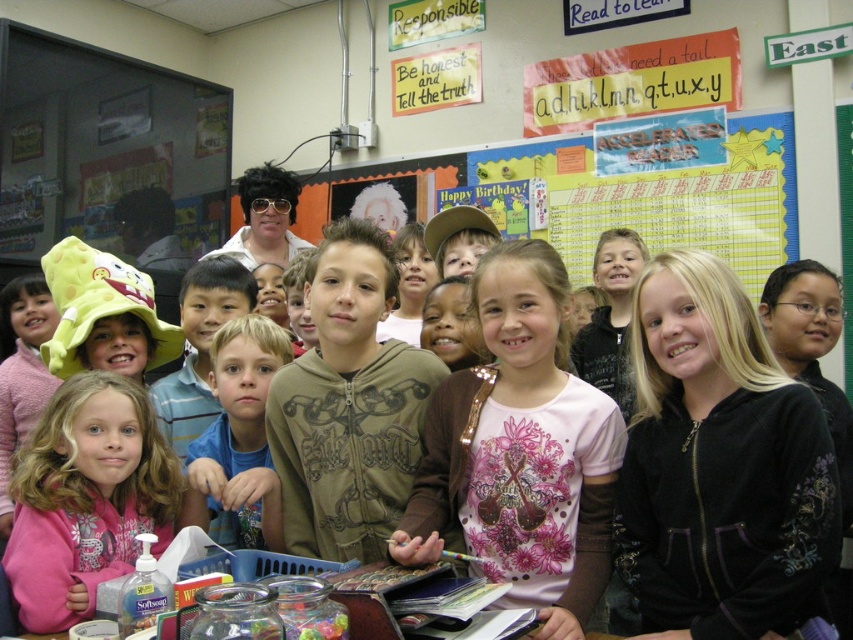
Is point (666, 528) more distant than point (564, 602)?

No, it is in front of (564, 602).

Is black velvety hoodie at center below pink satin shirt at center?

Correct, black velvety hoodie at center is located below pink satin shirt at center.

Which is in front, point (693, 266) or point (489, 499)?

Positioned in front is point (693, 266).

You are a GUI agent. You are given a task and a screenshot of the screen. Output one action in this format:
    pyautogui.click(x=<x>, y=<y>)
    Task: Click on the black velvety hoodie at center
    The width and height of the screenshot is (853, 640).
    Given the screenshot: What is the action you would take?
    pyautogui.click(x=718, y=467)

Measure the distance from black velvety hoodie at center to pink fleece jacket at lower left.

A distance of 1.25 meters exists between black velvety hoodie at center and pink fleece jacket at lower left.

Is black velvety hoodie at center to the left of pink fleece jacket at lower left from the viewer's perspective?

Incorrect, black velvety hoodie at center is not on the left side of pink fleece jacket at lower left.

Is point (750, 417) closer to camera compared to point (51, 554)?

Yes, it is in front of point (51, 554).

The width and height of the screenshot is (853, 640). Identify the location of black velvety hoodie at center. (718, 467).

Can you confirm if pink fleece jacket at lower left is thinner than white wig at center?

No, pink fleece jacket at lower left is not thinner than white wig at center.

Does pink fleece jacket at lower left appear on the left side of white wig at center?

Incorrect, pink fleece jacket at lower left is not on the left side of white wig at center.

Which is in front, point (54, 465) or point (264, 236)?

Positioned in front is point (54, 465).

Identify the location of pink fleece jacket at lower left. (86, 497).